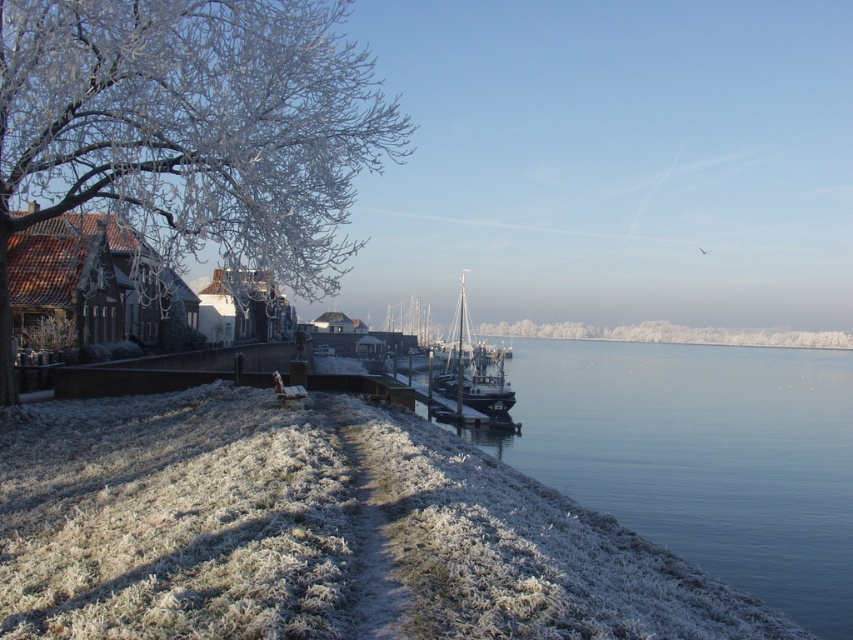
Between frosted glass tree at left and blue glassy water at lower left, which one is positioned lower?

blue glassy water at lower left

The width and height of the screenshot is (853, 640). What do you see at coordinates (190, 129) in the screenshot?
I see `frosted glass tree at left` at bounding box center [190, 129].

In order to click on frosted glass tree at left in this screenshot , I will do `click(190, 129)`.

Can you confirm if frosted glass tree at left is positioned to the right of white wooden sailboat at center?

No, frosted glass tree at left is not to the right of white wooden sailboat at center.

Who is positioned more to the left, frosted glass tree at left or white wooden sailboat at center?

From the viewer's perspective, frosted glass tree at left appears more on the left side.

This screenshot has height=640, width=853. I want to click on frosted glass tree at left, so click(x=190, y=129).

Locate an element on the screen. blue glassy water at lower left is located at coordinates tap(701, 456).

Looking at this image, can you confirm if blue glassy water at lower left is taller than white wooden sailboat at center?

No.

Between point (798, 392) and point (479, 388), which one is positioned in front?

Point (479, 388) is more forward.

Locate an element on the screen. The height and width of the screenshot is (640, 853). blue glassy water at lower left is located at coordinates (701, 456).